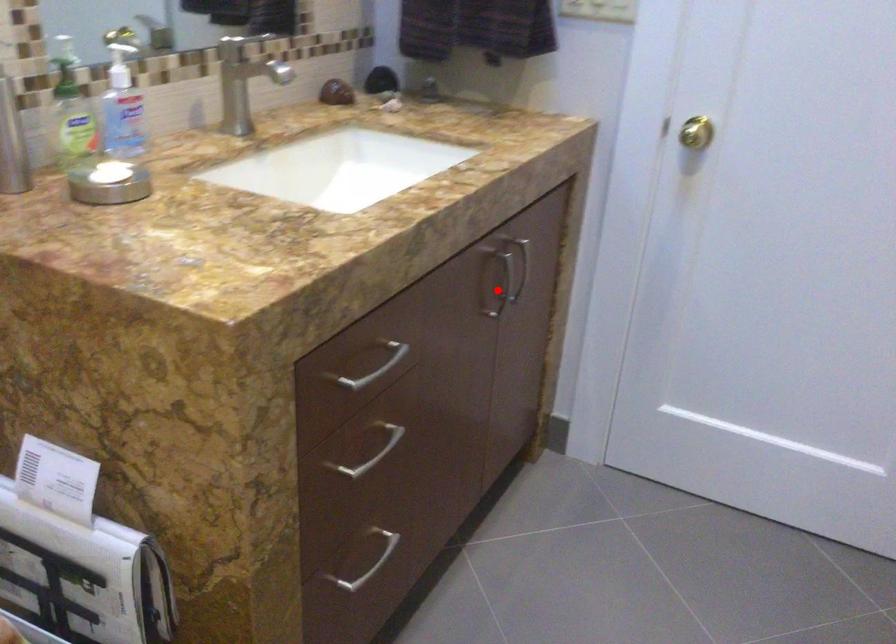
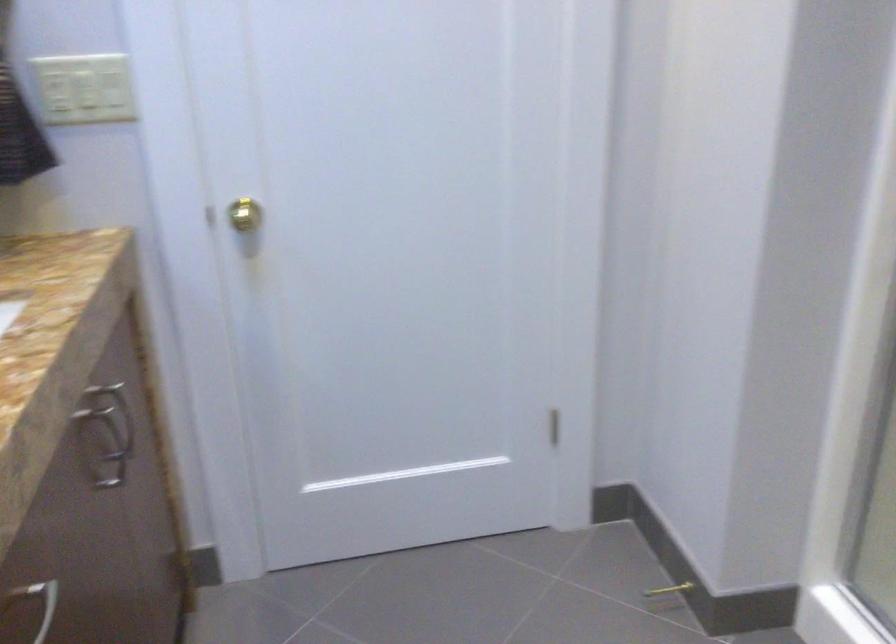
Question: I am providing you with two images of the same scene from different viewpoints. Given a red point in image1, look at the same physical point in image2. Is it:

Choices:
 (A) Closer to the viewpoint
 (B) Farther from the viewpoint

Answer: (A)